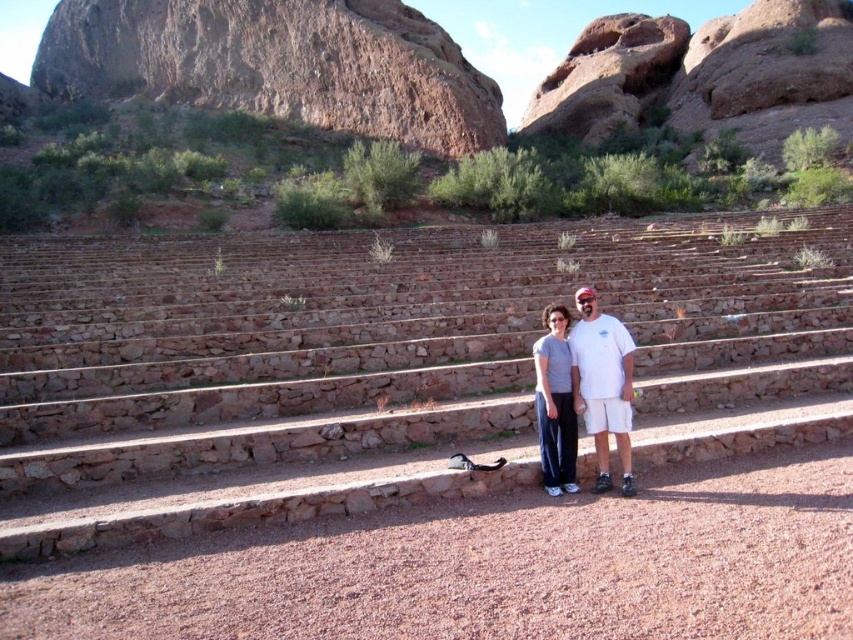
Question: Estimate the real-world distances between objects in this image. Which object is farther from the brown stone stairs at center?

Choices:
 (A) matte gray pants at center
 (B) white cotton t-shirt at center

Answer: (A)

Question: Among these objects, which one is farthest from the camera?

Choices:
 (A) matte gray pants at center
 (B) brown stone stairs at center

Answer: (A)

Question: Can you confirm if brown stone stairs at center is positioned above matte gray pants at center?

Choices:
 (A) yes
 (B) no

Answer: (A)

Question: Can you confirm if brown stone stairs at center is positioned to the left of matte gray pants at center?

Choices:
 (A) yes
 (B) no

Answer: (A)

Question: Among these points, which one is nearest to the camera?

Choices:
 (A) 569,474
 (B) 599,332
 (C) 592,472

Answer: (A)

Question: In this image, where is brown stone stairs at center located relative to white cotton t-shirt at center?

Choices:
 (A) left
 (B) right

Answer: (A)